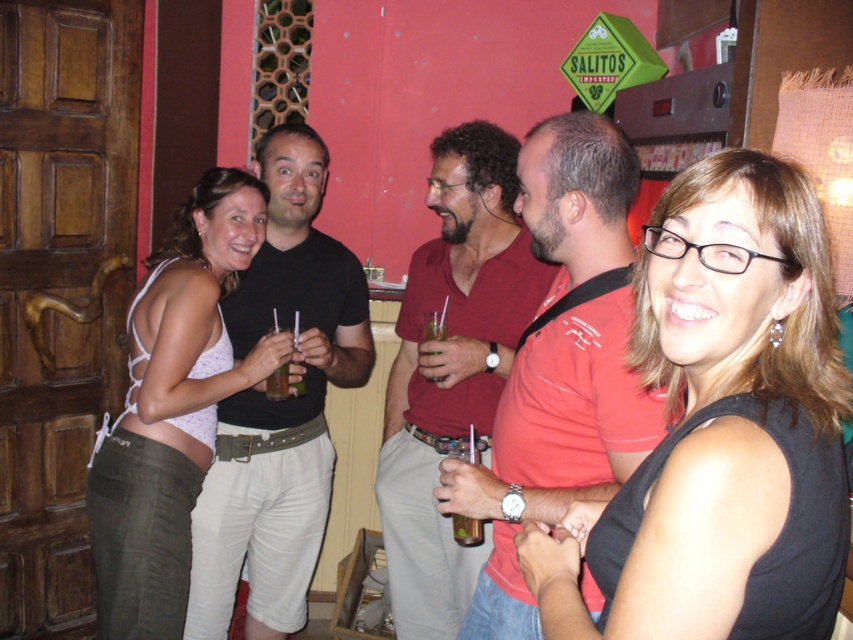
Question: Which object is closer to the camera taking this photo?

Choices:
 (A) matte red shirt at center
 (B) translucent plastic cup at center

Answer: (A)

Question: Among these objects, which one is nearest to the camera?

Choices:
 (A) red cotton shirt at center
 (B) black cotton shirt at center

Answer: (A)

Question: Is red cotton shirt at center thinner than black cotton shirt at center?

Choices:
 (A) yes
 (B) no

Answer: (A)

Question: Which object appears closest to the camera in this image?

Choices:
 (A) matte red shirt at center
 (B) clear plastic cup at center

Answer: (B)

Question: In this image, where is matte red shirt at center located relative to translucent plastic cup at center?

Choices:
 (A) left
 (B) right

Answer: (B)

Question: Is black fabric shirt at center smaller than black cotton shirt at center?

Choices:
 (A) no
 (B) yes

Answer: (B)